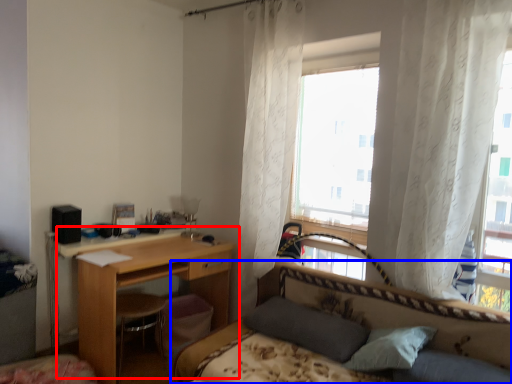
Question: Which object appears closest to the camera in this image, desk (highlighted by a red box) or bed (highlighted by a blue box)?

Choices:
 (A) desk
 (B) bed

Answer: (B)